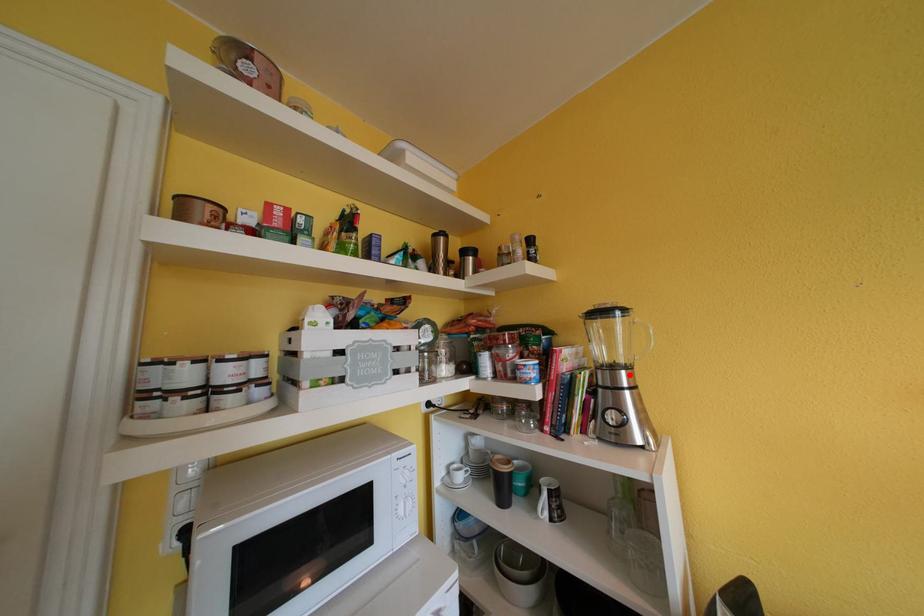
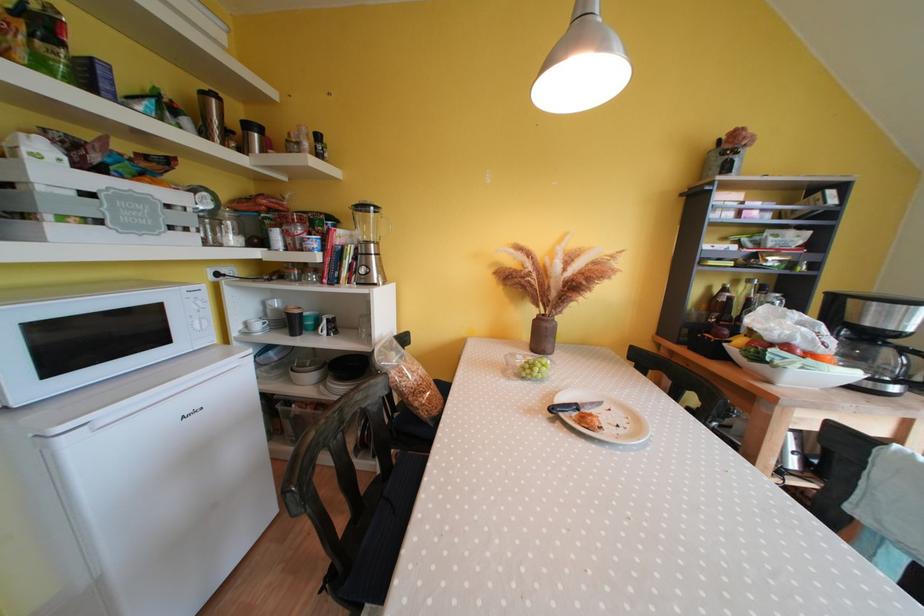
Locate, in the second image, the point that corresponds to the highlighted location in the first image.

(379, 249)